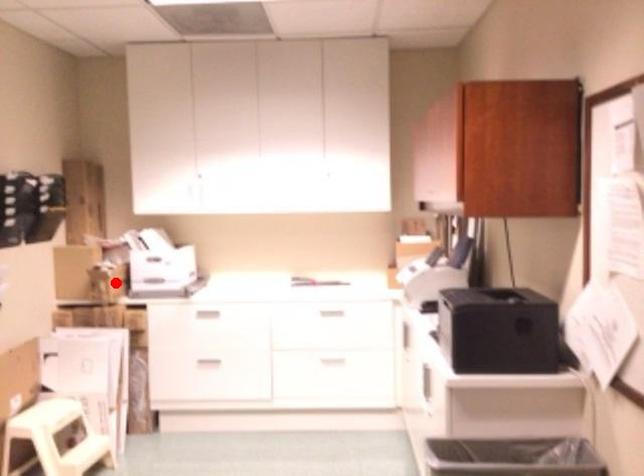
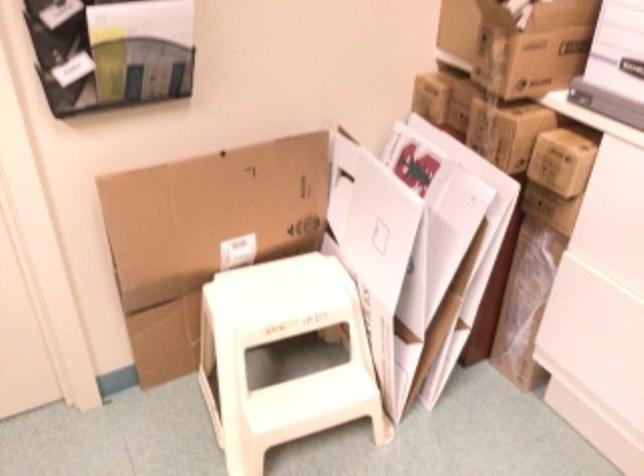
Question: A red point is marked in image1. In image2, is the corresponding 3D point closer to the camera or farther? Reply with the corresponding letter.

Choices:
 (A) The corresponding 3D point is closer.
 (B) The corresponding 3D point is farther.

Answer: (A)